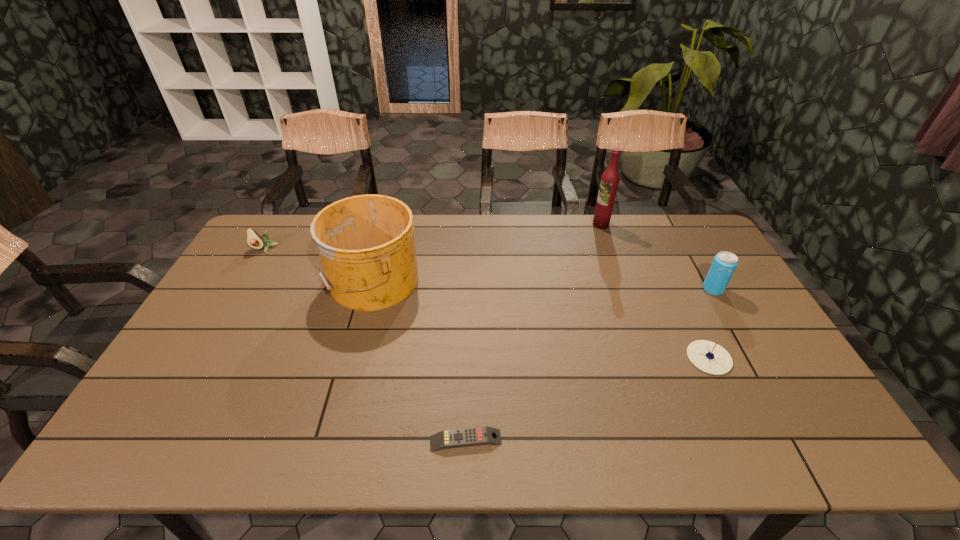
Identify the location of the shortest object. Image resolution: width=960 pixels, height=540 pixels. (476, 436).

Locate an element on the screen. The image size is (960, 540). the third object from left to right is located at coordinates (476, 436).

Identify the location of free spot located on the label of the farthest object. This screenshot has height=540, width=960. (564, 225).

You are a GUI agent. You are given a task and a screenshot of the screen. Output one action in this format:
    pyautogui.click(x=<x>, y=<y>)
    Task: Click on the free location located 0.290m on the label of the farthest object
    The height and width of the screenshot is (540, 960).
    Given the screenshot: What is the action you would take?
    pyautogui.click(x=516, y=225)

Where is `free spot located on the label of the farthest object`? free spot located on the label of the farthest object is located at coordinates (544, 225).

This screenshot has width=960, height=540. I want to click on vacant area situated on the left of the bucket, so click(x=232, y=280).

This screenshot has height=540, width=960. I want to click on vacant space located on the back of the third tallest object, so click(x=698, y=262).

Where is `vacant region located on the seed side of the leftmost object`? Image resolution: width=960 pixels, height=540 pixels. vacant region located on the seed side of the leftmost object is located at coordinates (243, 285).

You are a GUI agent. You are given a task and a screenshot of the screen. Output one action in this format:
    pyautogui.click(x=<x>, y=<y>)
    Task: Click on the vacant region located 0.370m on the left of the fifth object from left to right
    
    Given the screenshot: What is the action you would take?
    pyautogui.click(x=551, y=358)

Image resolution: width=960 pixels, height=540 pixels. I want to click on vacant area situated 0.080m on the right of the remote control, so click(537, 441).